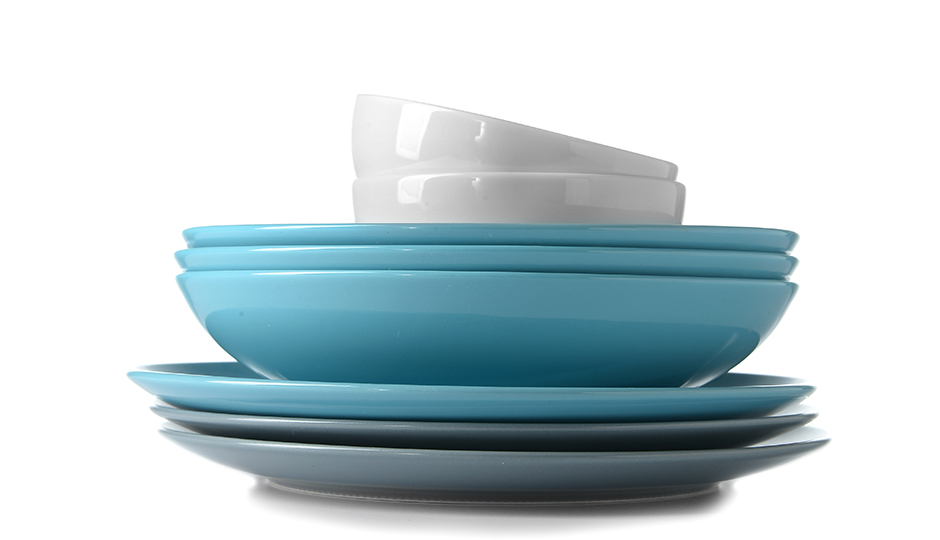
You are a GUI agent. You are given a task and a screenshot of the screen. Output one action in this format:
    pyautogui.click(x=<x>, y=<y>)
    Task: Click on the number of dishes
    The width and height of the screenshot is (940, 540).
    Given the screenshot: What is the action you would take?
    pyautogui.click(x=634, y=462), pyautogui.click(x=619, y=440), pyautogui.click(x=601, y=411), pyautogui.click(x=601, y=321), pyautogui.click(x=588, y=255), pyautogui.click(x=578, y=239), pyautogui.click(x=544, y=213), pyautogui.click(x=463, y=133)